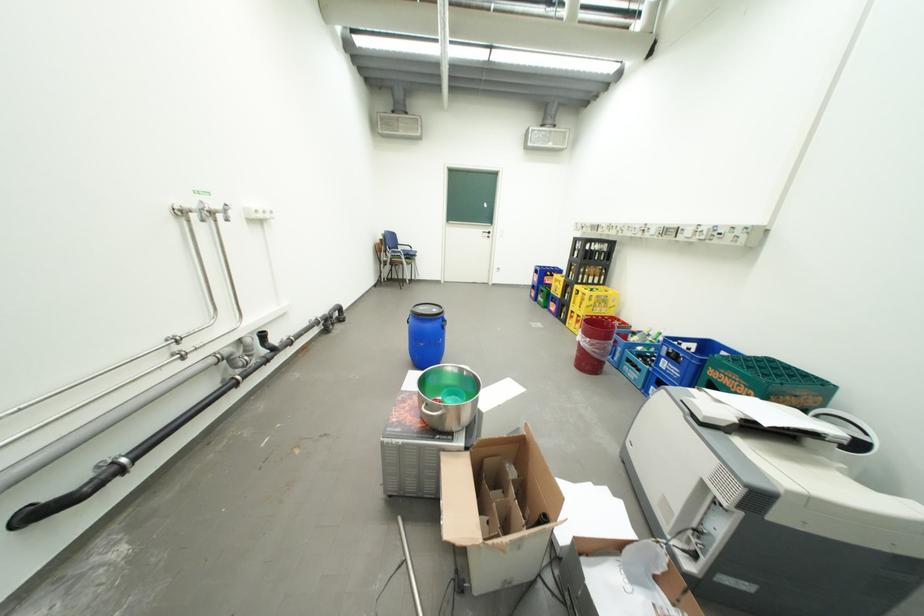
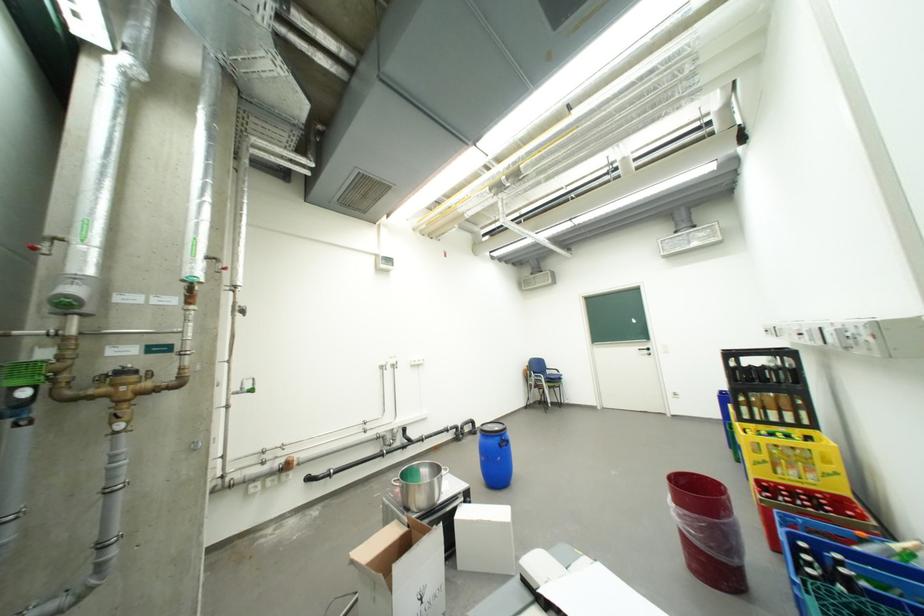
The point at (599, 341) is marked in the first image. Where is the corresponding point in the second image?

(685, 507)